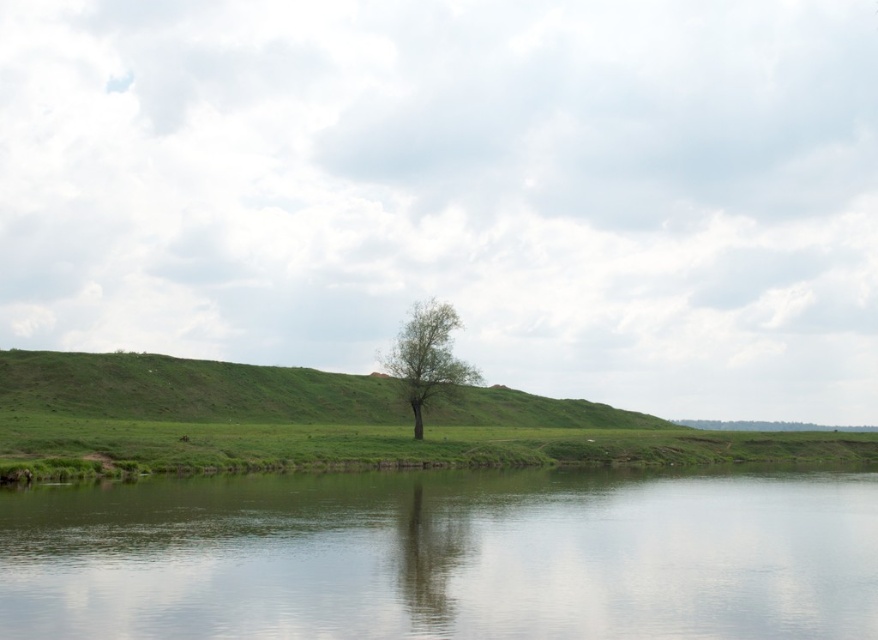
You are standing at the edge of the water in the scene. If you walk directly towards the point labeled as point (x=445, y=557), what will you encounter first?

You will encounter the green smooth water at center first because the point (x=445, y=557) corresponds to that location.

You are standing on the shore of the lake and see the green smooth water at center and the green leafy tree at center. Which object is closer to the water surface?

The green leafy tree at center is closer to the water surface because its reflection is visible on the green smooth water at center below it.